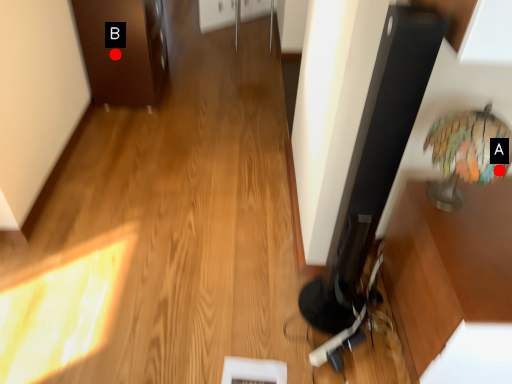
Question: Two points are circled on the image, labeled by A and B beside each circle. Which point is closer to the camera taking this photo?

Choices:
 (A) A is closer
 (B) B is closer

Answer: (A)